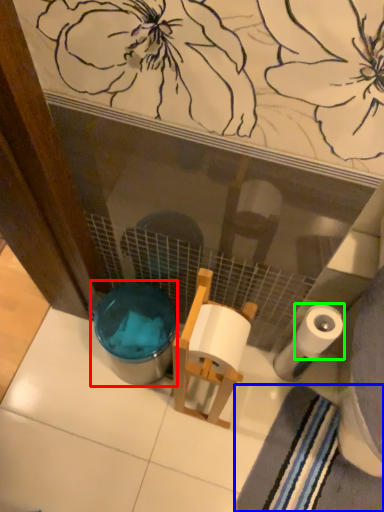
Question: Which object is the closest to the potty (highlighted by a red box)? Choose among these: bath towel (highlighted by a blue box) or toilet paper (highlighted by a green box).

Choices:
 (A) bath towel
 (B) toilet paper

Answer: (B)